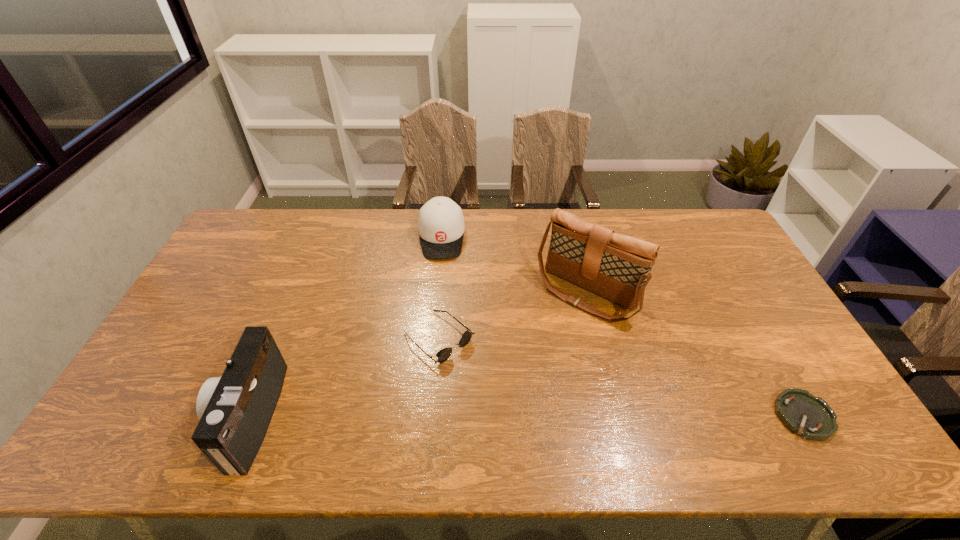
Find the location of a particular element. This screenshot has height=540, width=960. the leftmost object is located at coordinates (235, 410).

Locate an element on the screen. camcorder is located at coordinates (235, 410).

Identify the location of ashtray. (810, 417).

At what (x,y) coordinates should I click in order to perform the action: click on the shortest object. Please return your answer as a coordinate pair (x, y). The image size is (960, 540). Looking at the image, I should click on tap(810, 417).

Locate an element on the screen. the tallest object is located at coordinates (617, 267).

This screenshot has width=960, height=540. I want to click on the fourth object from left to right, so [x=617, y=267].

In order to click on sunglasses in this screenshot , I will do `click(445, 353)`.

At what (x,y) coordinates should I click in order to perform the action: click on the third tallest object. Please return your answer as a coordinate pair (x, y). The height and width of the screenshot is (540, 960). Looking at the image, I should click on (441, 226).

Image resolution: width=960 pixels, height=540 pixels. Find the location of `baseball cap`. baseball cap is located at coordinates (441, 226).

Locate an element on the screen. vacant position located on the lens of the fourth shortest object is located at coordinates (181, 416).